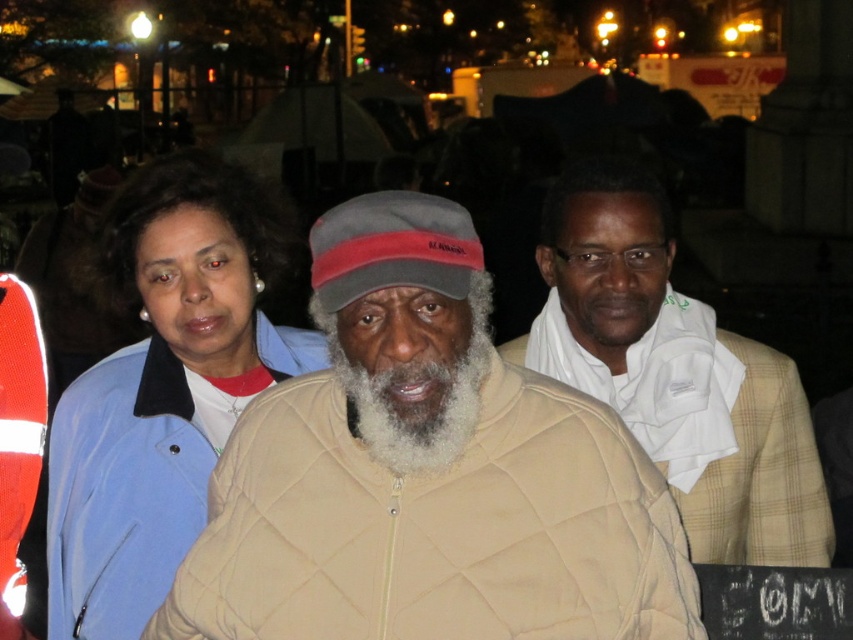
Question: Estimate the real-world distances between objects in this image. Which object is farther from the white fuzzy beard at center?

Choices:
 (A) white textured scarf at center
 (B) tan quilted jacket at center

Answer: (A)

Question: Which point appears farthest from the camera in this image?

Choices:
 (A) (631, 317)
 (B) (358, 547)

Answer: (A)

Question: Can you confirm if blue quilted jacket at center is positioned below white fuzzy beard at center?

Choices:
 (A) yes
 (B) no

Answer: (A)

Question: Based on their relative distances, which object is nearer to the blue quilted jacket at center?

Choices:
 (A) white fuzzy beard at center
 (B) tan quilted jacket at center
 (C) white textured scarf at center

Answer: (B)

Question: Does white textured scarf at center have a greater width compared to white fuzzy beard at center?

Choices:
 (A) no
 (B) yes

Answer: (B)

Question: Can you confirm if tan quilted jacket at center is positioned to the right of white fuzzy beard at center?

Choices:
 (A) yes
 (B) no

Answer: (B)